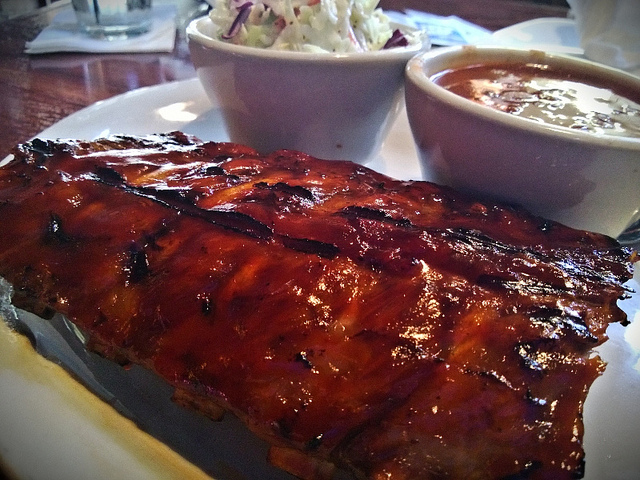
Find the location of a particular element. rim of ramekin of cole slaw is located at coordinates (284, 56).